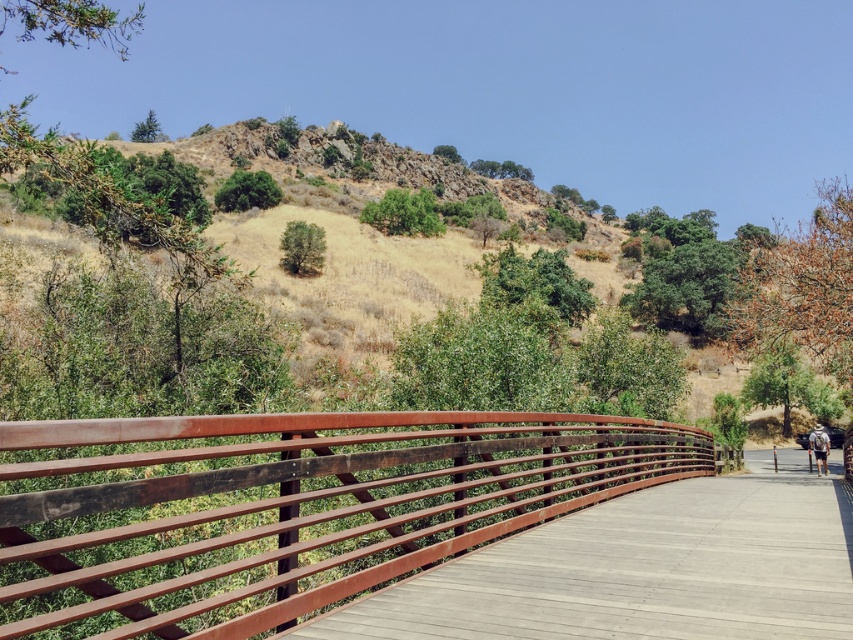
You are a hiker carrying a white fabric backpack at lower right and want to rest your hand on the rustic wood rail at center while crossing the bridge. Will the rail be wide enough for your hand to grip comfortably?

The rustic wood rail at center has a width less than the white fabric backpack at lower right. Since the backpack is wider, the rail may not provide enough space for a comfortable grip, so it might be too narrow.

You are a hiker carrying the white fabric backpack at lower right and want to cross the wooden bridge at center. Can you safely walk across it with your backpack?

The wooden bridge at center has a width less than the white fabric backpack at lower right. Therefore, it might be too narrow for you to safely walk across while carrying the backpack.

You are standing on the wooden bridge and notice a rustic wood rail at center and a white fabric backpack at lower right. Which object is located higher in the scene?

The rustic wood rail at center is positioned over the white fabric backpack at lower right, so the rustic wood rail at center is higher.